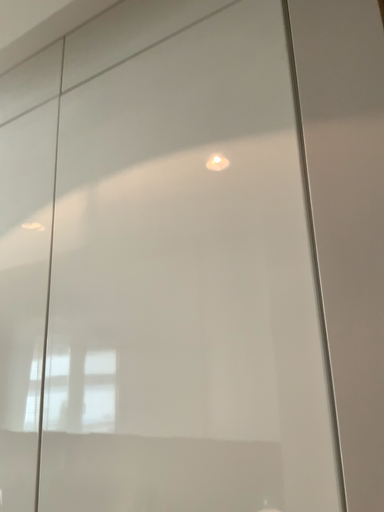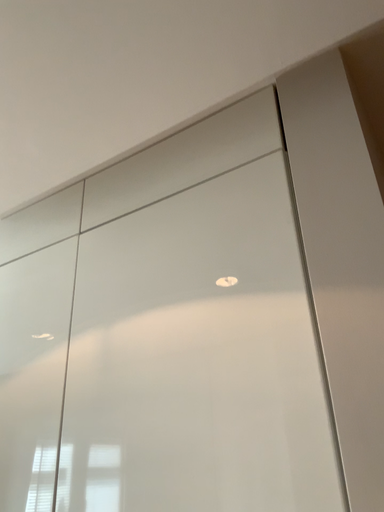
Question: How did the camera likely rotate when shooting the video?

Choices:
 (A) rotated downward
 (B) rotated upward

Answer: (B)